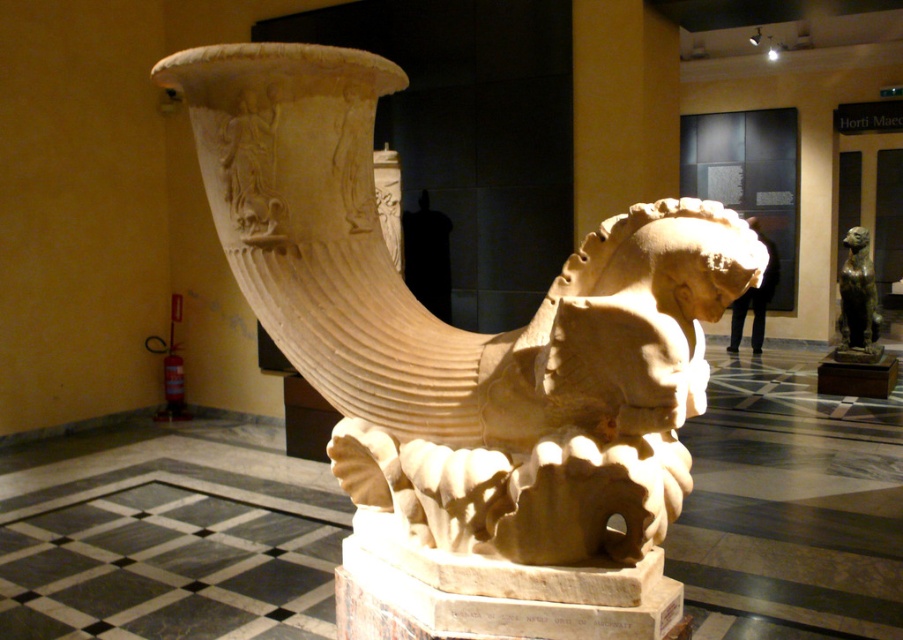
Between beige stone vase at center and bronze statue at right, which one is positioned higher?

bronze statue at right is higher up.

Does beige stone vase at center appear on the left side of bronze statue at right?

Indeed, beige stone vase at center is positioned on the left side of bronze statue at right.

Who is more forward, (362, 403) or (848, 332)?

Point (362, 403) is in front.

Locate an element on the screen. The image size is (903, 640). beige stone vase at center is located at coordinates (458, 328).